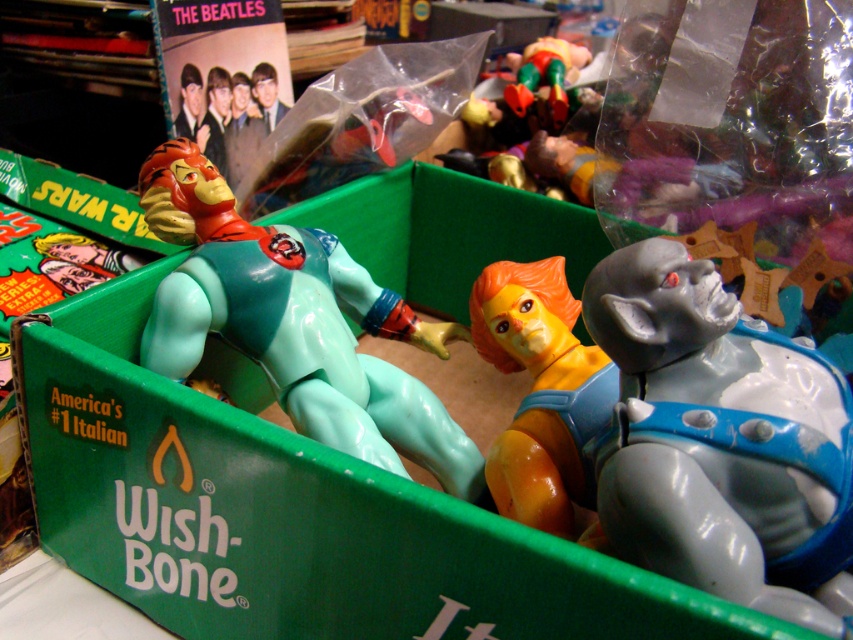
Question: Among these points, which one is nearest to the camera?

Choices:
 (A) (523, 67)
 (B) (514, 300)
 (C) (624, 497)
 (D) (180, 449)

Answer: (C)

Question: Among these objects, which one is farthest from the camera?

Choices:
 (A) yellow plastic pliers at center
 (B) gray matte gorilla at center
 (C) shiny metallic figure at upper center
 (D) orange matte figure at center

Answer: (C)

Question: Is gray matte gorilla at center thinner than orange matte figure at center?

Choices:
 (A) no
 (B) yes

Answer: (A)

Question: Which object appears farthest from the camera in this image?

Choices:
 (A) gray matte gorilla at center
 (B) light blue plastic figure at center
 (C) shiny metallic figure at upper center

Answer: (C)

Question: Is light blue plastic figure at center above yellow plastic pliers at center?

Choices:
 (A) no
 (B) yes

Answer: (B)

Question: Where is light blue plastic figure at center located in relation to shiny metallic figure at upper center in the image?

Choices:
 (A) right
 (B) left

Answer: (B)